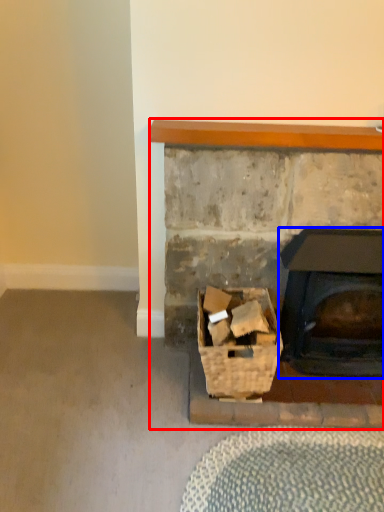
Question: Which object is further to the camera taking this photo, fireplace (highlighted by a red box) or wood burning stove (highlighted by a blue box)?

Choices:
 (A) fireplace
 (B) wood burning stove

Answer: (B)